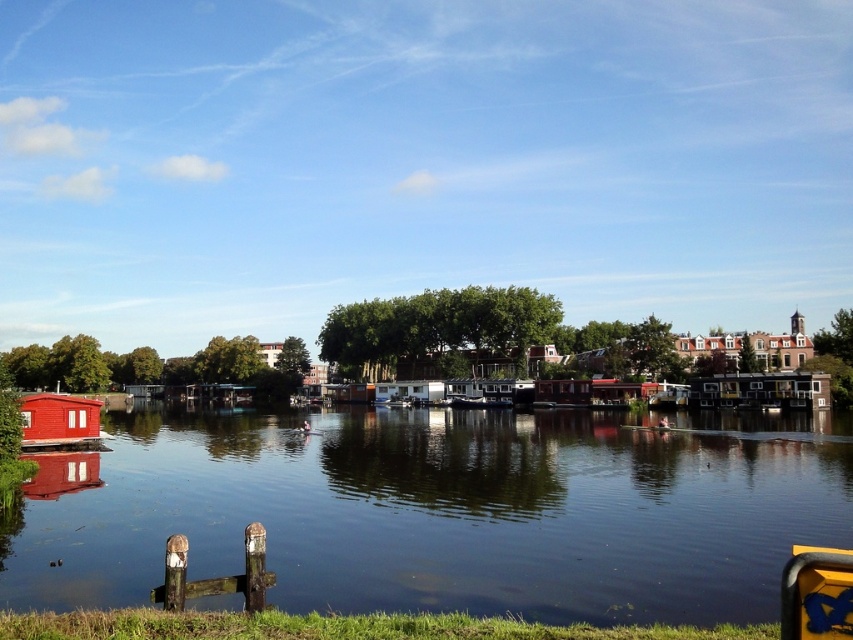
Looking at this image, you are standing on the riverside and want to take a photo of the smooth water at center. Based on the coordinates provided, which direction should you face to capture it in your shot?

The smooth water at center is located at point 0.798 in the x coordinate and 0.523 in the y coordinate. To capture it, you should aim your camera towards the central area slightly to the right since higher x values indicate rightward direction and higher y values indicate upward direction.

You are standing at the edge of the river in the serene riverside scene. You notice two points marked in the image. Which point, point (531,596) or point (45,404), is closer to you?

Point (531,596) is closer to the viewer than point (45,404).

You are standing on the riverside path and want to take a photo of both the smooth water at center and the matte wooden hut at left. Which object should you position closer to the left side of your camera frame to include both in the shot?

You should position the matte wooden hut at left closer to the left side of your camera frame because the smooth water at center is to the right of the matte wooden hut at left, so placing the hut on the left edge allows the water to naturally extend to the right within the frame.